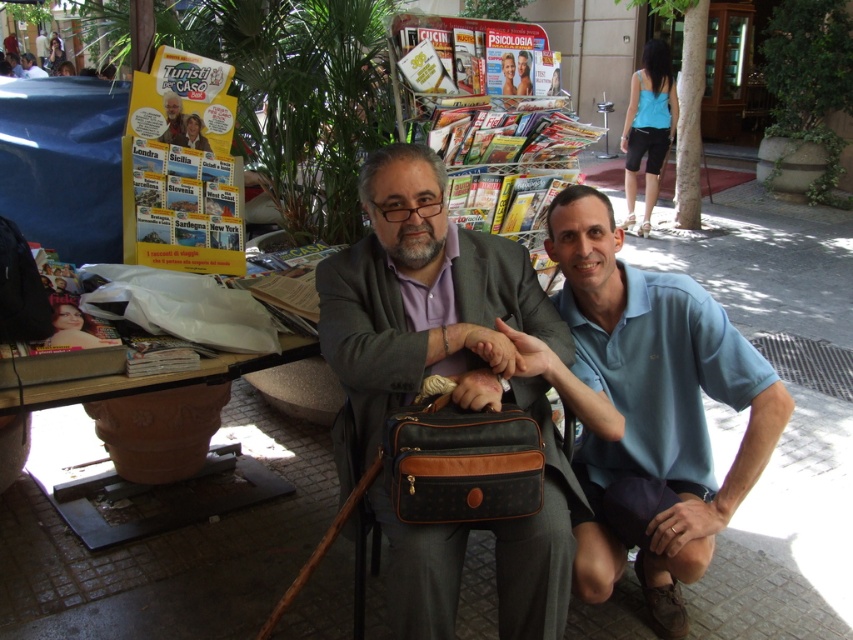
Consider the image. You are standing at the point with coordinates point [415,456] and want to walk to the point with coordinates point [471,320]. Which direction should you move in relative to the other point?

You should move backward because point [471,320] is behind point [415,456].

You are a delivery person who needs to place both the brown textured briefcase at center and the matte black jacket at center into a storage locker. The locker has a maximum capacity of 2 cubic feet. If the briefcase takes up 1.5 cubic feet, will both items fit?

The brown textured briefcase at center is bigger than the matte black jacket at center. Since the briefcase already occupies 1.5 cubic feet, there is only 0.5 cubic feet remaining. If the jacket requires more than 0.5 cubic feet, it wonn fit. However, since the briefcase is larger, it is possible the jacket is smaller and may fit within the remaining space. Without exact measurements, we cannot be certain, but based on size comparison, there is a chance both could fit if the jacket is under 0.5 cubic feet.

You are standing in front of the kiosk and want to place a small object on the table between the two points labeled point (395,417) and point (175,124). Which point should you choose to ensure the object is closer to you?

Point (395,417) is closer to the viewer than point (175,124), so placing the object there will keep it nearer to you.